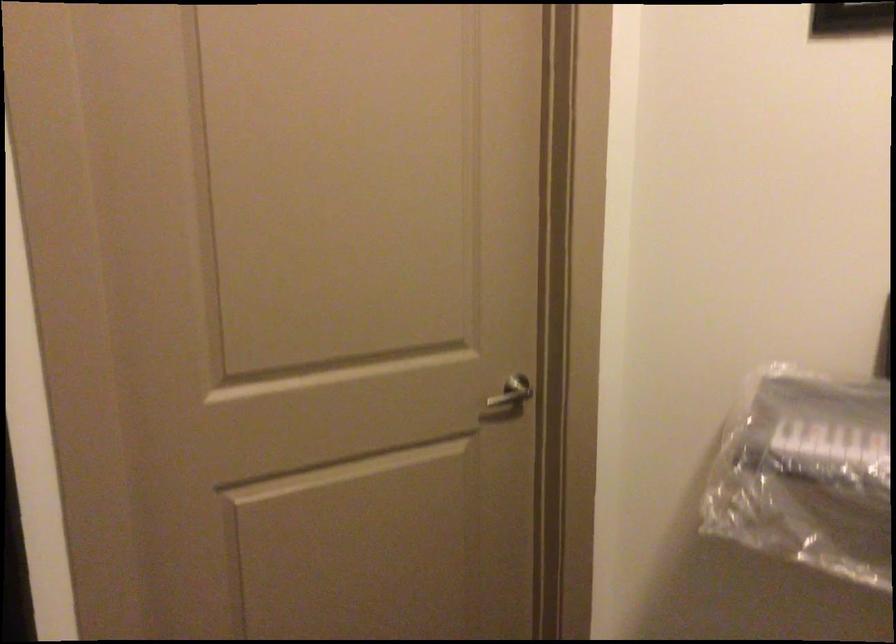
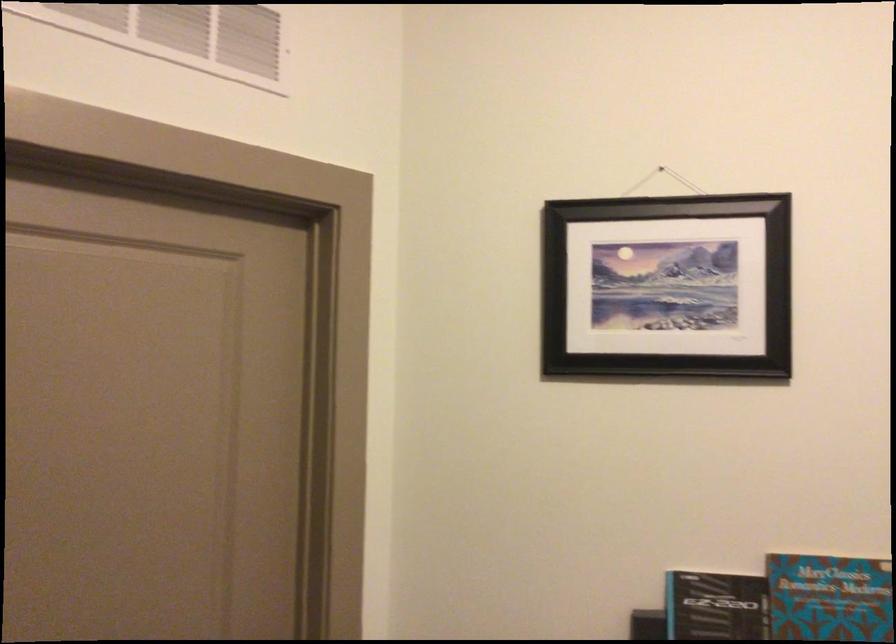
Which direction would the cameraman need to move to produce the second image?

The cameraman moved toward right, backward.